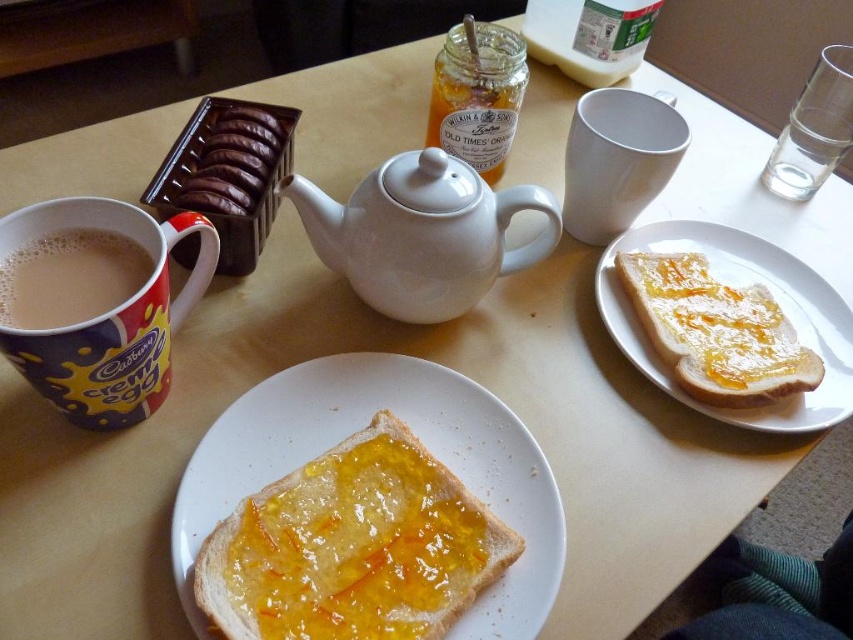
Question: Which object is closer to the camera taking this photo?

Choices:
 (A) chocolate-coated wafer at upper left
 (B) white matte mug at upper center
 (C) white ceramic plate at upper right
 (D) translucent glass jar at upper center

Answer: (C)

Question: Does white glossy teapot at center appear under creamy ceramic mug at left?

Choices:
 (A) no
 (B) yes

Answer: (A)

Question: Which object is farther from the camera taking this photo?

Choices:
 (A) white glossy teapot at center
 (B) creamy ceramic mug at left

Answer: (A)

Question: Which of the following is the closest to the observer?

Choices:
 (A) (392, 172)
 (B) (331, 422)

Answer: (B)

Question: Is white matte mug at upper center wider than translucent glass jar at upper center?

Choices:
 (A) no
 (B) yes

Answer: (B)

Question: Does yellowish matte toast at center appear on the left side of matte ceramic mug at left?

Choices:
 (A) yes
 (B) no

Answer: (B)